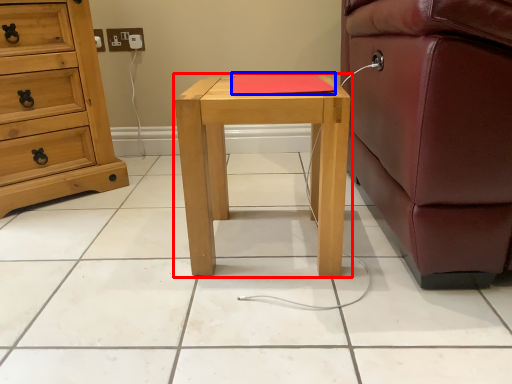
Question: Among these objects, which one is nearest to the camera, nightstand (highlighted by a red box) or pad (highlighted by a blue box)?

Choices:
 (A) nightstand
 (B) pad

Answer: (A)